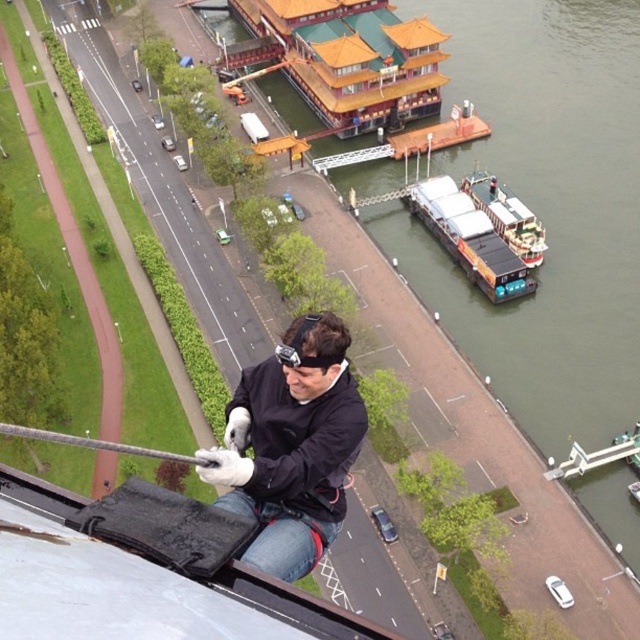
From the picture: You are a city inspector who needs to reach the yellow matte barge at right from the black matte jacket at center. Based on the scene, which direction should you move towards?

The black matte jacket at center is to the left of the yellow matte barge at right, so you should move towards the right to reach the yellow matte barge at right.